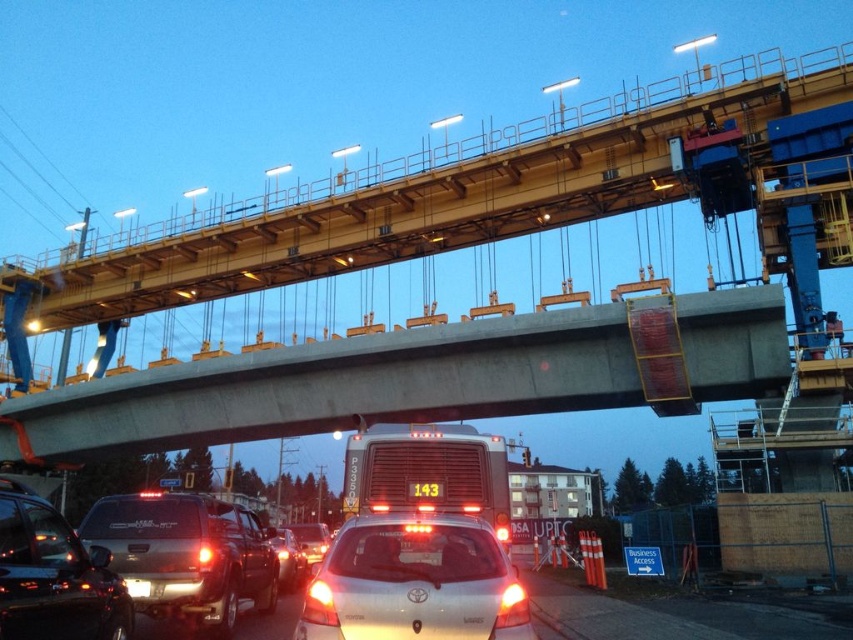
Consider the image. Is satin silver sedan at center smaller than matte black trailer truck at center?

No.

Does satin silver sedan at center have a lesser width compared to matte black trailer truck at center?

In fact, satin silver sedan at center might be wider than matte black trailer truck at center.

Where is `satin silver sedan at center`? This screenshot has height=640, width=853. satin silver sedan at center is located at coordinates (415, 582).

Which is more to the right, satin silver sedan at center or satin black suv at lower left?

satin silver sedan at center

Does satin silver sedan at center have a greater height compared to satin black suv at lower left?

Yes, satin silver sedan at center is taller than satin black suv at lower left.

You are a GUI agent. You are given a task and a screenshot of the screen. Output one action in this format:
    pyautogui.click(x=<x>, y=<y>)
    Task: Click on the satin silver sedan at center
    
    Given the screenshot: What is the action you would take?
    (x=415, y=582)

Who is positioned more to the left, satin silver sedan at center or white plastic license plate at center?

satin silver sedan at center is more to the left.

Based on the photo, who is more distant from viewer, (467, 588) or (436, 554)?

Positioned behind is point (436, 554).

Image resolution: width=853 pixels, height=640 pixels. In order to click on satin silver sedan at center in this screenshot , I will do `click(415, 582)`.